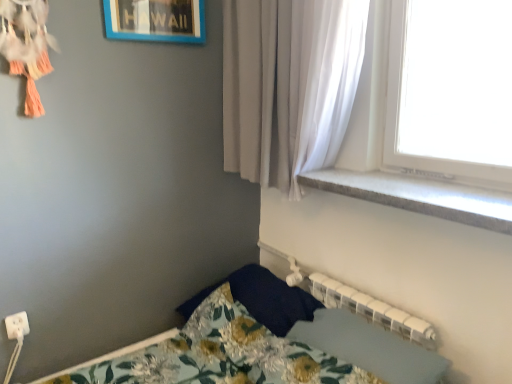
Question: Considering the positions of white plastic electric outlet at lower left and blue plastic picture frame at upper center in the image, is white plastic electric outlet at lower left wider or thinner than blue plastic picture frame at upper center?

Choices:
 (A) wide
 (B) thin

Answer: (B)

Question: Is point (8, 322) closer or farther from the camera than point (138, 23)?

Choices:
 (A) farther
 (B) closer

Answer: (B)

Question: Which object is positioned farthest from the gray concrete window sill at upper right?

Choices:
 (A) dark blue fabric pillow at lower center
 (B) blue plastic picture frame at upper center
 (C) white plastic electric outlet at lower left
 (D) floral fabric bed at lower left
 (E) floral fabric bedsheet at lower center

Answer: (C)

Question: Estimate the real-world distances between objects in this image. Which object is farther from the gray concrete window sill at upper right?

Choices:
 (A) white sheer curtain at upper right
 (B) white plastic electric outlet at lower left
 (C) floral fabric bedsheet at lower center
 (D) floral fabric bed at lower left
 (E) blue plastic picture frame at upper center

Answer: (B)